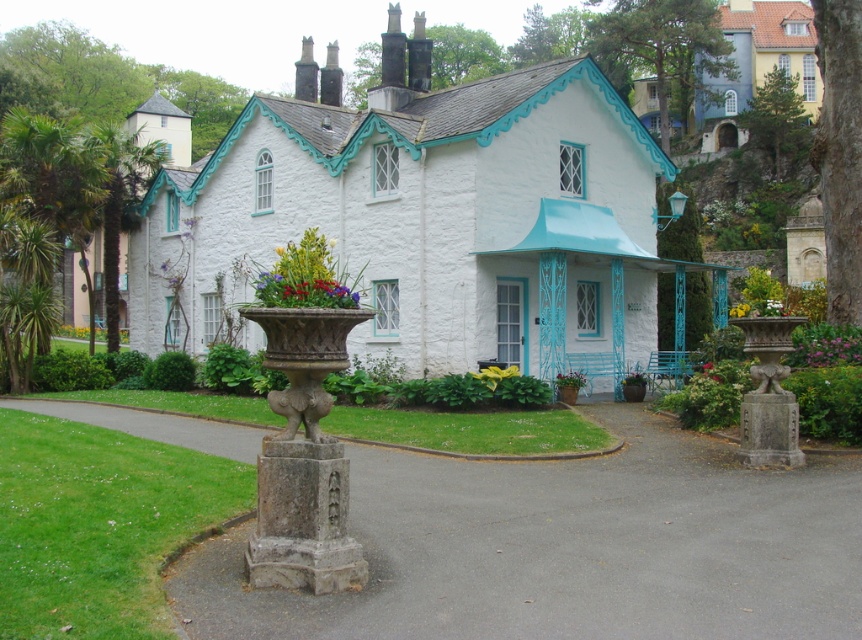
Does gray asphalt driveway at lower center have a lesser height compared to green matte flower at center?

No.

Can you confirm if gray asphalt driveway at lower center is taller than green matte flower at center?

Indeed, gray asphalt driveway at lower center has a greater height compared to green matte flower at center.

The width and height of the screenshot is (862, 640). Identify the location of gray asphalt driveway at lower center. (567, 547).

Between gray asphalt driveway at lower center and white fabric flower at center, which one appears on the right side from the viewer's perspective?

white fabric flower at center

The image size is (862, 640). I want to click on gray asphalt driveway at lower center, so click(567, 547).

Is point (453, 602) less distant than point (767, 307)?

Yes, it is.

Locate an element on the screen. gray asphalt driveway at lower center is located at coordinates (567, 547).

Is white fabric flower at center to the right of green matte flower at center from the viewer's perspective?

No, white fabric flower at center is not to the right of green matte flower at center.

What do you see at coordinates (773, 305) in the screenshot? I see `white fabric flower at center` at bounding box center [773, 305].

Is point (770, 298) more distant than point (701, 369)?

No.

The width and height of the screenshot is (862, 640). Identify the location of white fabric flower at center. (773, 305).